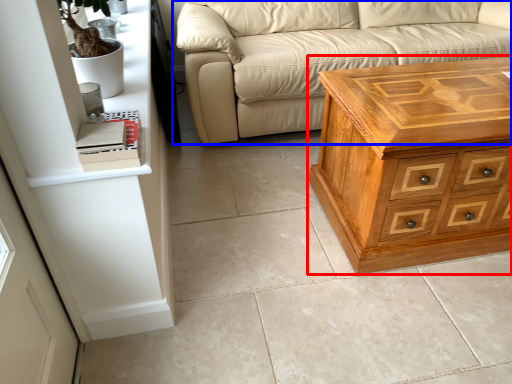
Question: Which of the following is the closest to the observer, chest of drawers (highlighted by a red box) or studio couch (highlighted by a blue box)?

Choices:
 (A) chest of drawers
 (B) studio couch

Answer: (A)